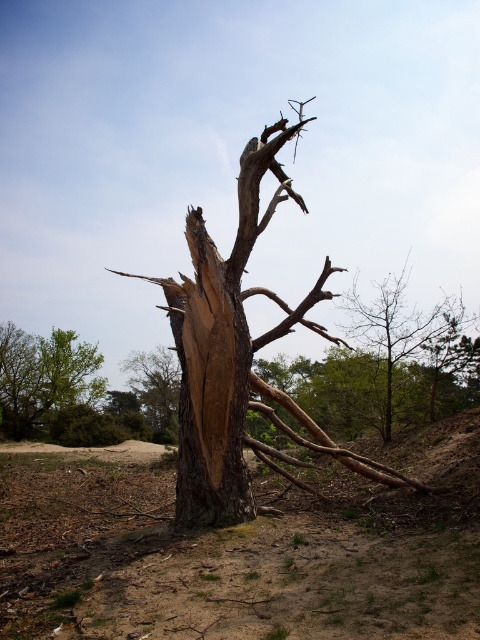
You are a hiker who wants to take a photo of both the green leafy tree at lower left and the brown rough bark tree at center. Which tree should you move closer to in order to capture both in the same frame?

You should move closer to the green leafy tree at lower left because it is closer to you than the brown rough bark tree at center, allowing both trees to be in the same frame.

You are an environmental inspector assessing the tree damage. You notice the dark brown wood at center and the brown rough bark tree at center. Which object is closer to you?

The dark brown wood at center is closer because it is in front of the brown rough bark tree at center.

You are standing at the center of the clearing and want to find the smooth brown tree trunk at center. Which direction should you look to locate it?

The smooth brown tree trunk at center is located at point coordinates of (x=397, y=326), so you should look towards the center of the image to find it.